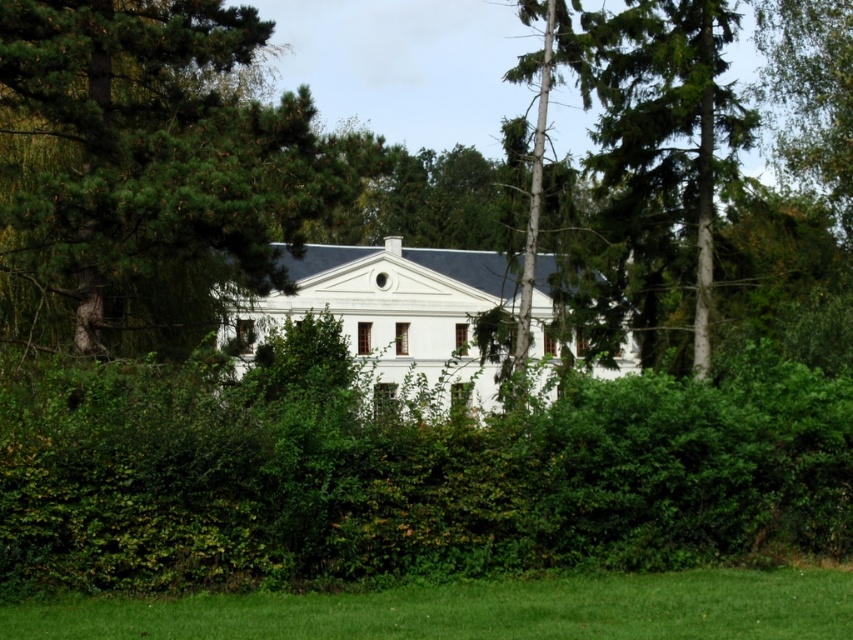
You are standing in front of the large white building with a dark blue roof. You want to place a new decorative statue exactly at the center of the green pine tree at center. What are the coordinates where you should place the statue?

The coordinates for the green pine tree at center are at point [149,168], so you should place the statue at those coordinates.

You are standing in front of the mansion and notice two elements in the center area. Which one is directly above the other between the green leafy hedge at center and the smooth bark tree at center?

The green leafy hedge at center is positioned under the smooth bark tree at center, so the smooth bark tree at center is directly above the green leafy hedge at center.